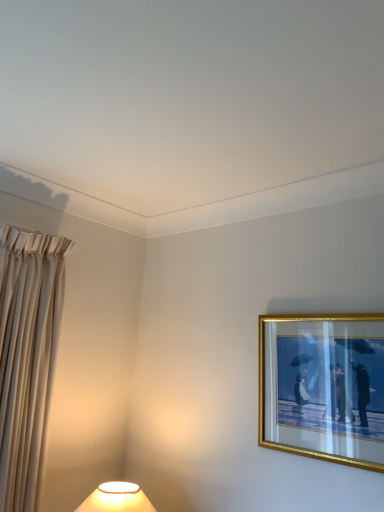
What is the approximate height of gold/glass picture frame at upper right?

It is 20.35 inches.

The height and width of the screenshot is (512, 384). Find the location of `gold/glass picture frame at upper right`. gold/glass picture frame at upper right is located at coordinates (323, 387).

What do you see at coordinates (323, 387) in the screenshot? Image resolution: width=384 pixels, height=512 pixels. I see `gold/glass picture frame at upper right` at bounding box center [323, 387].

Image resolution: width=384 pixels, height=512 pixels. I want to click on gold/glass picture frame at upper right, so click(x=323, y=387).